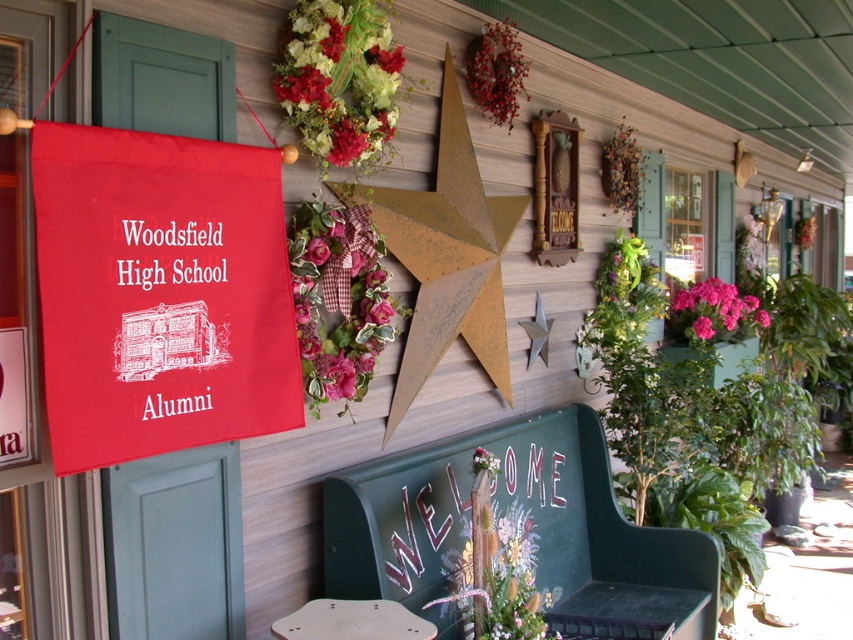
Question: Which point appears farthest from the camera in this image?

Choices:
 (A) (682, 289)
 (B) (83, 256)
 (C) (372, 243)

Answer: (A)

Question: Does floral bouquet at upper center come in front of red berry wreath at upper center?

Choices:
 (A) yes
 (B) no

Answer: (A)

Question: Which is nearer to the matte fabric banner at left?

Choices:
 (A) floral bouquet at upper center
 (B) pink fabric flower at center

Answer: (B)

Question: Is pink fabric flower at center thinner than pink matte flowers at right?

Choices:
 (A) no
 (B) yes

Answer: (B)

Question: Which object appears closest to the camera in this image?

Choices:
 (A) rustic wood star at center
 (B) pink fabric flower at center
 (C) matte fabric banner at left

Answer: (C)

Question: Is matte fabric banner at left below floral bouquet at upper center?

Choices:
 (A) yes
 (B) no

Answer: (A)